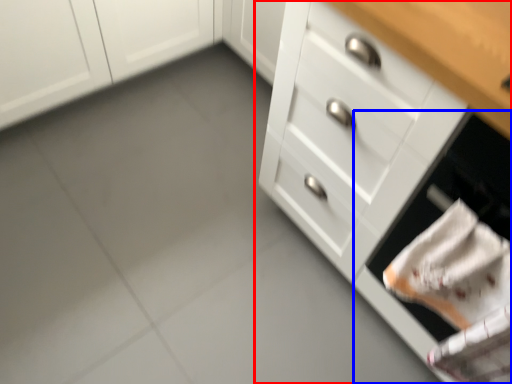
Question: Which object is closer to the camera taking this photo, chest of drawers (highlighted by a red box) or oven (highlighted by a blue box)?

Choices:
 (A) chest of drawers
 (B) oven

Answer: (B)